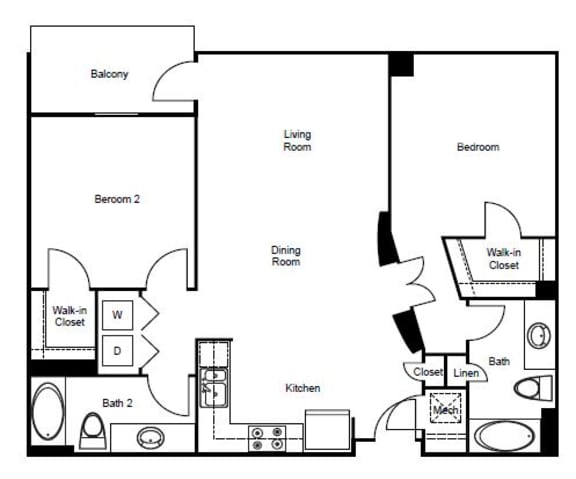
The width and height of the screenshot is (576, 479). Identify the location of sink. (178, 440), (541, 348), (215, 380).